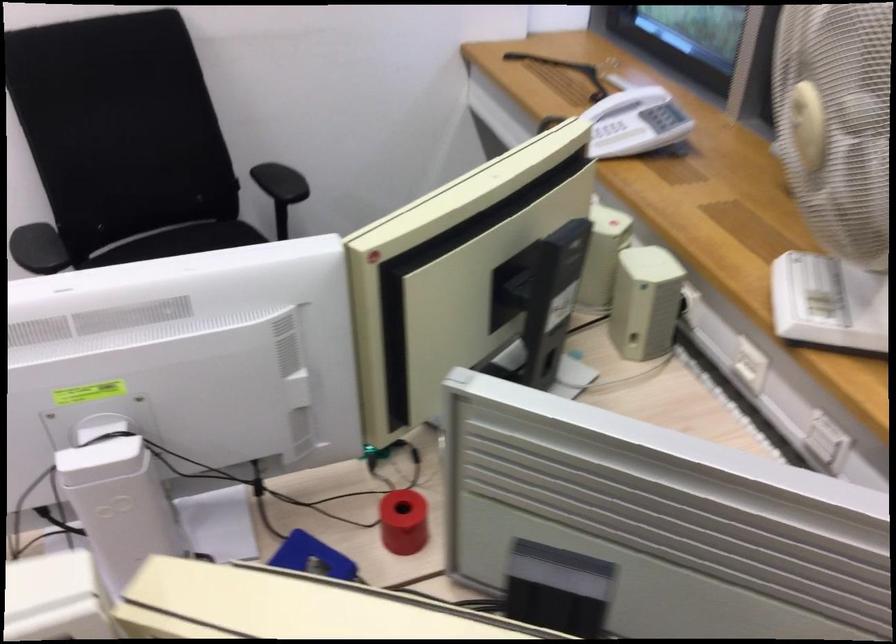
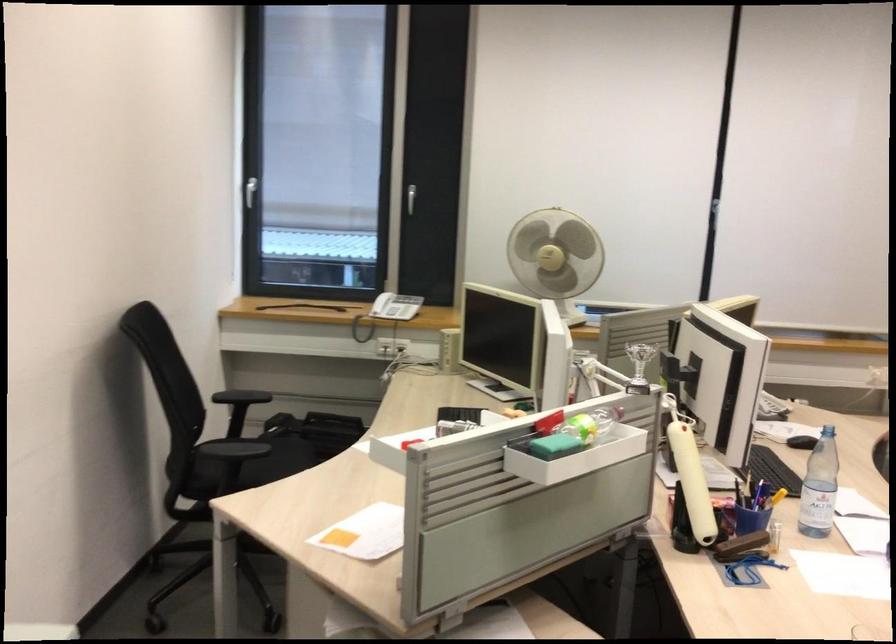
Where in the second image is the point corresponding to point (613, 153) from the first image?

(386, 312)